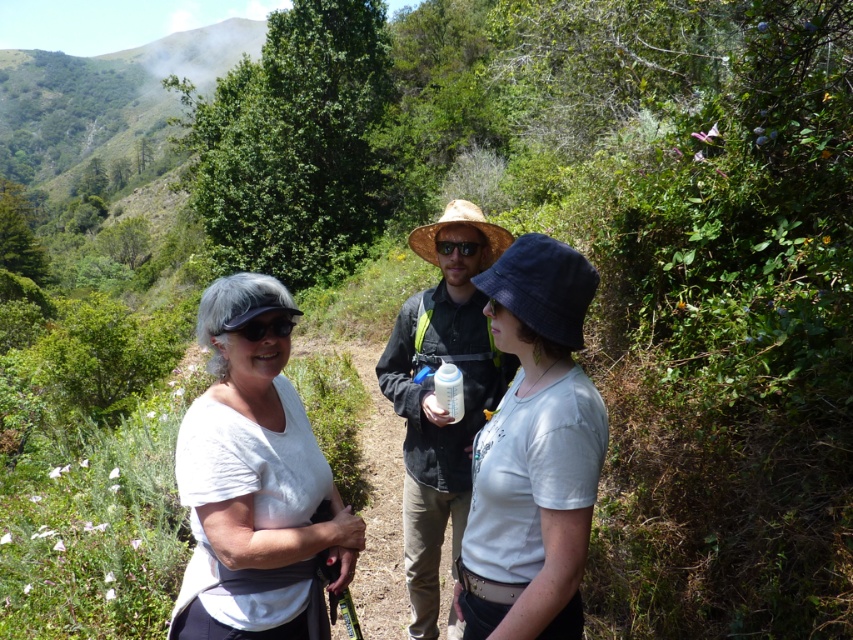
Question: Can you confirm if matte straw hat at center is wider than matte black goggles at center?

Choices:
 (A) yes
 (B) no

Answer: (A)

Question: Is the position of matte straw hat at center less distant than that of gold reflective sunglasses at center?

Choices:
 (A) yes
 (B) no

Answer: (A)

Question: Which point appears farthest from the camera in this image?

Choices:
 (A) (233, 326)
 (B) (403, 321)
 (C) (271, 420)

Answer: (B)

Question: Which is nearer to the matte black goggles at center?

Choices:
 (A) white matte shirt at center
 (B) denim hat at center

Answer: (A)

Question: Which point appears farthest from the camera in this image?

Choices:
 (A) (584, 394)
 (B) (456, 529)
 (C) (447, 243)
 (D) (260, 621)

Answer: (B)

Question: Does matte black goggles at center have a smaller size compared to gold reflective sunglasses at center?

Choices:
 (A) no
 (B) yes

Answer: (A)